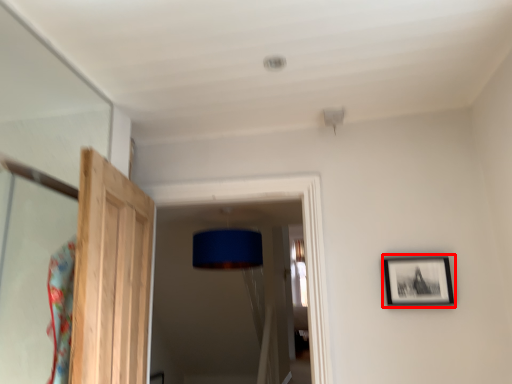
Question: From the image's perspective, where is picture frame (annotated by the red box) located in relation to door in the image?

Choices:
 (A) above
 (B) below

Answer: (B)